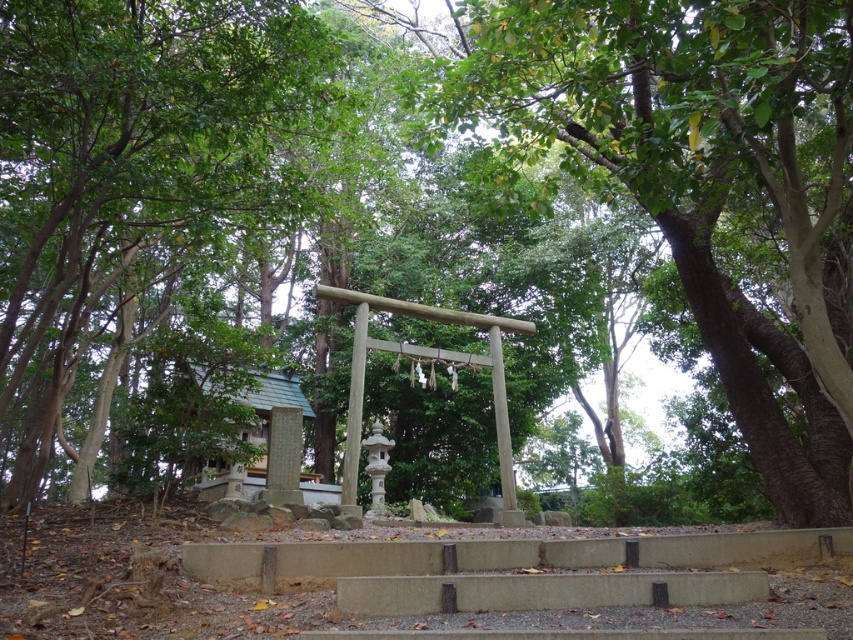
You are standing at the base of the steps leading up to the torii gate and want to walk towards the green leafy tree at center. Which direction should you turn to avoid the green leafy tree at left?

You should turn to the right to walk towards the green leafy tree at center, as it is positioned to the right of the green leafy tree at left.

You are standing at the bottom of the steps leading to the torii gate and want to take a photo of both the green leafy tree at center and the green leafy tree at left. Which tree should you position yourself closer to in order to capture both trees in the same frame?

You should position yourself closer to the green leafy tree at left because the green leafy tree at center is above it, so by moving closer to the lower tree, both trees will be within the camera frame.

You are planning to place a bench between the green leafy tree at center and the green leafy tree at left. The bench is 2 meters long. Is there enough space between them to fit the bench?

The distance between the green leafy tree at center and the green leafy tree at left is 6.30 meters. Since the bench is only 2 meters long, there is sufficient space to place it between them.